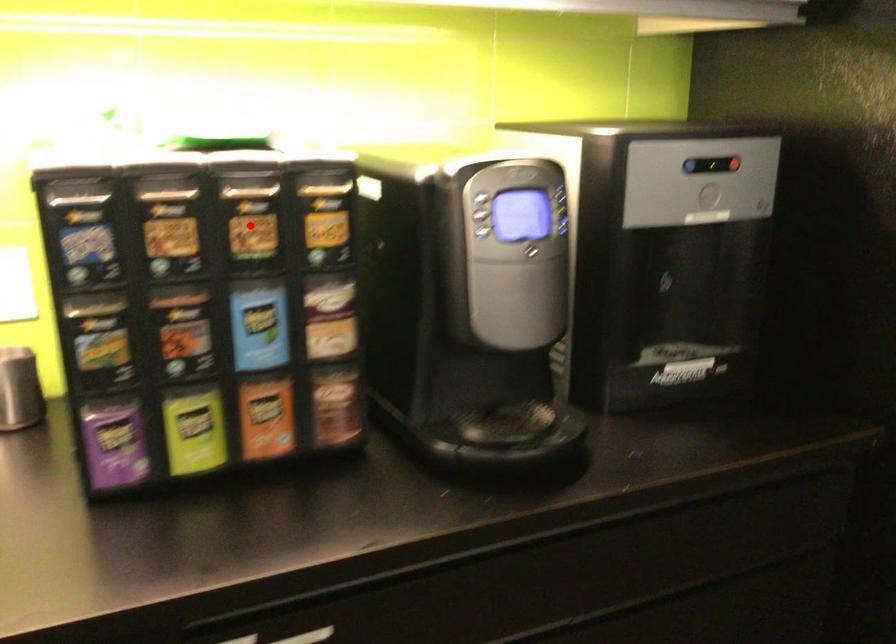
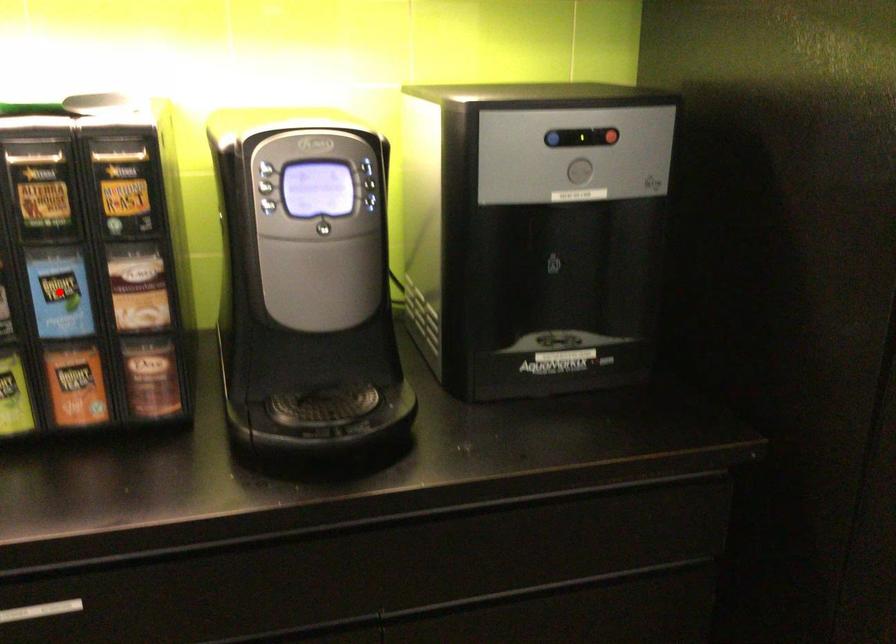
I am providing you with two images of the same scene from different viewpoints. A red point is marked on the first image and another point is marked on the second image. Does the point marked in image1 correspond to the same location as the one in image2?

No